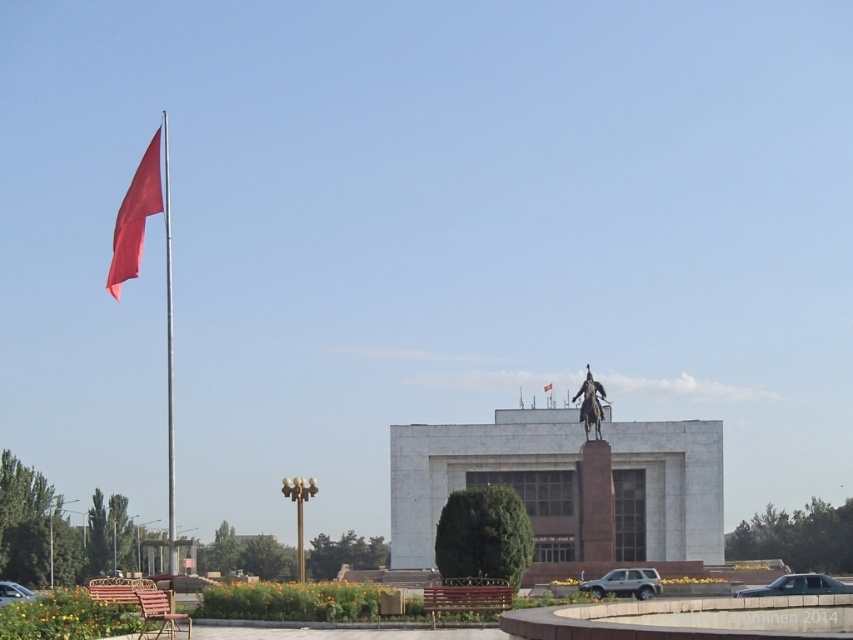
You are standing in the public square facing the large white building. You notice the smooth red flag at left and the metallic flag pole at left. Which object is higher from the ground?

The smooth red flag at left is above the metallic flag pole at left, so the smooth red flag at left is higher from the ground.

You are a tourist standing in the public square facing the large white building. You notice the smooth red flag at left and the metallic flag pole at left. Which object is positioned further to your left side?

The smooth red flag at left is positioned further to the left of the metallic flag pole at left.

You are standing in the public square and want to locate the metallic flag pole at left. According to the coordinates provided, where should you look?

The metallic flag pole at left is located at point (169, 358).